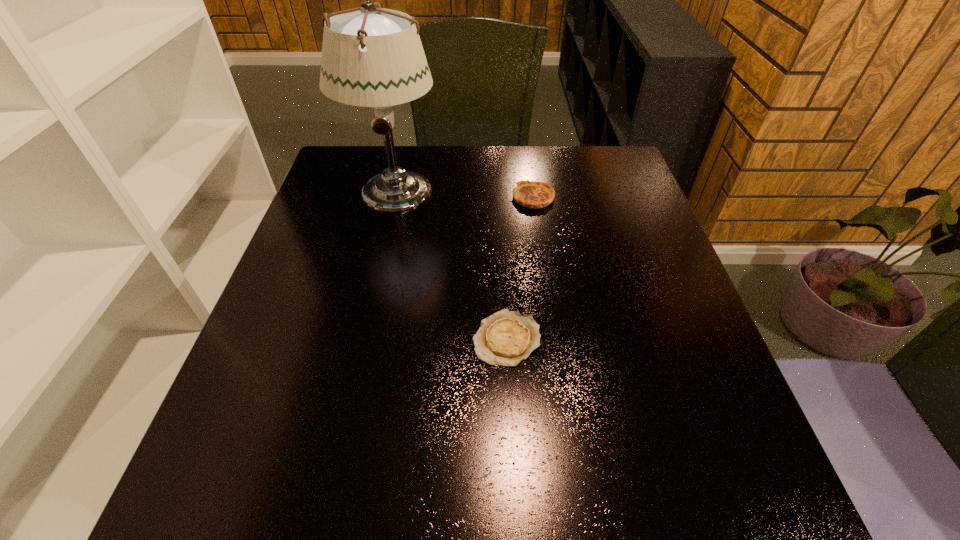
What are the coordinates of `quiche that is at the far edge` in the screenshot? It's located at (532, 194).

This screenshot has width=960, height=540. I want to click on object at the left edge, so (372, 57).

This screenshot has width=960, height=540. What are the coordinates of `object present at the far left corner` in the screenshot? It's located at (372, 57).

This screenshot has height=540, width=960. What are the coordinates of `vacant space at the far edge` in the screenshot? It's located at (397, 160).

The image size is (960, 540). I want to click on vacant space at the near edge of the desktop, so click(x=361, y=484).

Locate an element on the screen. The height and width of the screenshot is (540, 960). free space at the left edge is located at coordinates (299, 362).

I want to click on vacant space at the right edge of the desktop, so click(x=639, y=338).

Find the location of a particular element. The height and width of the screenshot is (540, 960). vacant space at the near left corner is located at coordinates (225, 503).

Locate an element on the screen. The width and height of the screenshot is (960, 540). blank region between the leftmost object and the nearer quiche is located at coordinates (450, 265).

Where is `free space between the shortest object and the taller quiche`? free space between the shortest object and the taller quiche is located at coordinates (520, 268).